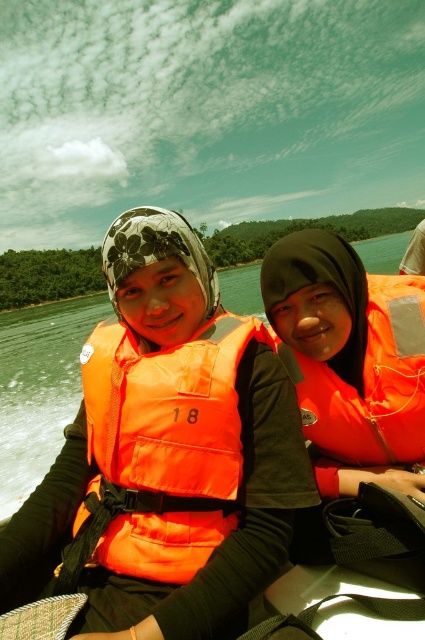
Question: Is orange life vest at center below orange matte life jacket at right?

Choices:
 (A) no
 (B) yes

Answer: (A)

Question: Which point is closer to the camera?

Choices:
 (A) orange matte life jacket at right
 (B) orange life vest at center
 (C) orange fabric life vest at center

Answer: (C)

Question: Which object is positioned closest to the orange life vest at center?

Choices:
 (A) orange matte life jacket at right
 (B) orange fabric life vest at center

Answer: (B)

Question: From the image, what is the correct spatial relationship of orange life vest at center in relation to orange matte life jacket at right?

Choices:
 (A) left
 (B) right

Answer: (A)

Question: Does orange fabric life vest at center lie behind orange life vest at center?

Choices:
 (A) yes
 (B) no

Answer: (B)

Question: Among these points, which one is nearest to the camera?

Choices:
 (A) (362, 403)
 (B) (197, 401)

Answer: (B)